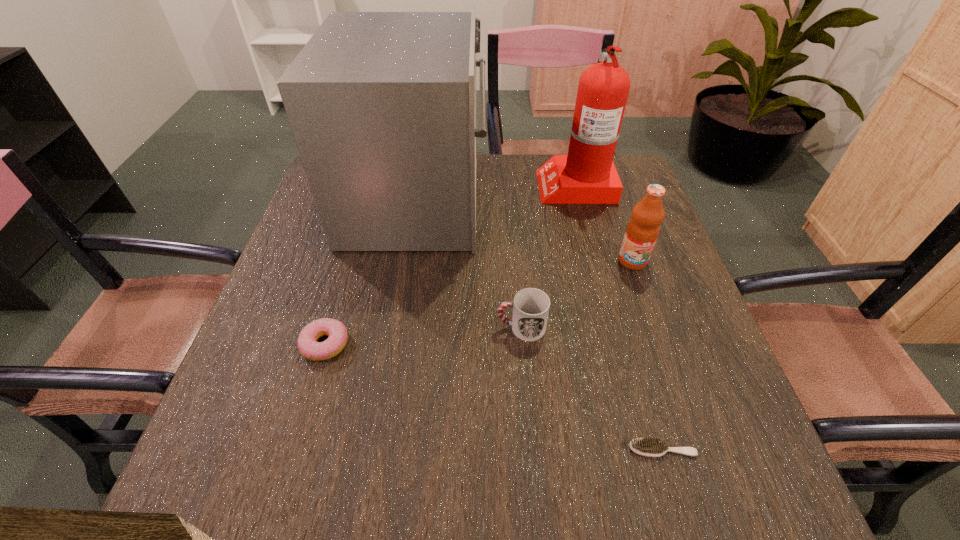
This screenshot has height=540, width=960. In the image, there is a desktop. In order to click on vacant space at the near edge in this screenshot , I will do `click(492, 461)`.

Where is `free space at the left edge of the desktop`? The height and width of the screenshot is (540, 960). free space at the left edge of the desktop is located at coordinates click(280, 287).

This screenshot has width=960, height=540. Find the location of `free region at the right edge of the desktop`. free region at the right edge of the desktop is located at coordinates (625, 309).

This screenshot has width=960, height=540. I want to click on free area in between the third shortest object and the fire extinguisher, so click(548, 256).

This screenshot has height=540, width=960. Identify the location of vacant region between the fire extinguisher and the fourth object from right to left. (548, 256).

You are a GUI agent. You are given a task and a screenshot of the screen. Output one action in this format:
    pyautogui.click(x=<x>, y=<y>)
    Task: Click on the empty space that is in between the fourth shortest object and the second shortest object
    This screenshot has height=540, width=960.
    Given the screenshot: What is the action you would take?
    pyautogui.click(x=479, y=303)

At what (x,y) coordinates should I click in order to perform the action: click on free space between the cup and the doughnut. Please return your answer as a coordinate pair (x, y). This screenshot has width=960, height=540. Looking at the image, I should click on (423, 336).

You are a GUI agent. You are given a task and a screenshot of the screen. Output one action in this format:
    pyautogui.click(x=<x>, y=<y>)
    Task: Click on the free space between the fruit juice and the cup
    The width and height of the screenshot is (960, 540).
    Given the screenshot: What is the action you would take?
    pyautogui.click(x=577, y=294)

Locate an element on the screen. empty space between the fire extinguisher and the toaster oven is located at coordinates (496, 193).

You are a GUI agent. You are given a task and a screenshot of the screen. Output one action in this format:
    pyautogui.click(x=<x>, y=<y>)
    Task: Click on the free spot between the fifth tallest object and the fire extinguisher
    This screenshot has width=960, height=540.
    Given the screenshot: What is the action you would take?
    pyautogui.click(x=450, y=265)